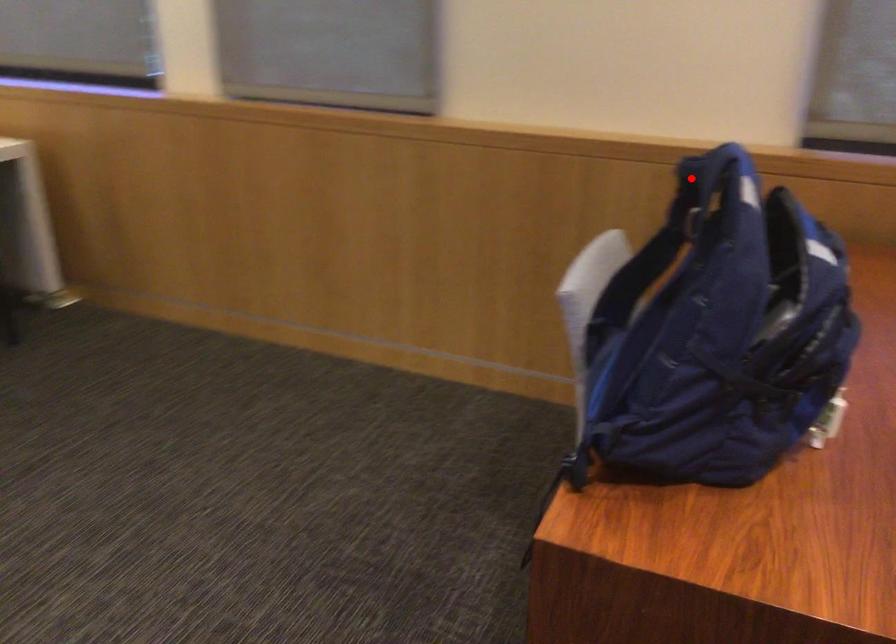
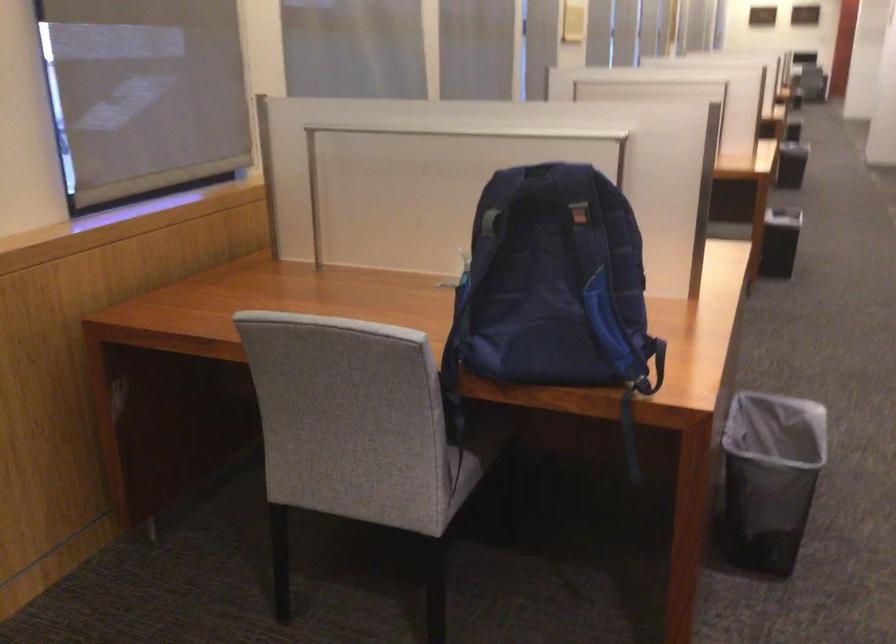
Question: I am providing you with two images of the same scene from different viewpoints. In image1, a red point is highlighted. Considering the same 3D point in image2, which of the following is correct?

Choices:
 (A) It is closer
 (B) It is farther

Answer: (B)